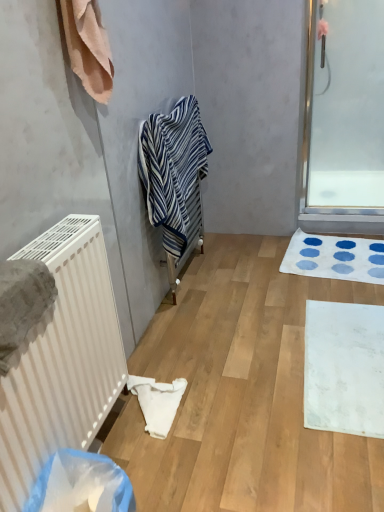
Question: Does white matte bath mat at lower right, the 2th bath mat from the top, have a lesser width compared to beige cotton towel at upper left, the 2th towel in the front-to-back sequence?

Choices:
 (A) yes
 (B) no

Answer: (B)

Question: Is white matte bath mat at lower right, which appears as the first bath mat when viewed from the front, directly adjacent to beige cotton towel at upper left, the 2th towel in the front-to-back sequence?

Choices:
 (A) yes
 (B) no

Answer: (B)

Question: Can you confirm if white matte bath mat at lower right, arranged as the second bath mat when viewed from the back, is shorter than beige cotton towel at upper left, placed as the second towel when sorted from back to front?

Choices:
 (A) no
 (B) yes

Answer: (B)

Question: From the image's perspective, is white matte bath mat at lower right, the first bath mat when ordered from bottom to top, beneath beige cotton towel at upper left, marked as the second towel in a right-to-left arrangement?

Choices:
 (A) no
 (B) yes

Answer: (B)

Question: Considering the relative sizes of white matte bath mat at lower right, which appears as the first bath mat when viewed from the front, and beige cotton towel at upper left, placed as the second towel when sorted from back to front, in the image provided, is white matte bath mat at lower right, which appears as the first bath mat when viewed from the front, bigger than beige cotton towel at upper left, placed as the second towel when sorted from back to front,?

Choices:
 (A) yes
 (B) no

Answer: (A)

Question: From their relative heights in the image, would you say gray textured towel at left, positioned as the 1th towel in front-to-back order, is taller or shorter than white matte bath mat at lower right, arranged as the second bath mat when viewed from the back?

Choices:
 (A) tall
 (B) short

Answer: (A)

Question: From a real-world perspective, is gray textured towel at left, the first towel viewed from the left, positioned above or below white matte bath mat at lower right, the first bath mat when ordered from bottom to top?

Choices:
 (A) below
 (B) above

Answer: (B)

Question: From the image's perspective, relative to white matte bath mat at lower right, the first bath mat when ordered from bottom to top, is gray textured towel at left, the first towel viewed from the left, above or below?

Choices:
 (A) below
 (B) above

Answer: (B)

Question: Does point [x=52, y=298] appear closer or farther from the camera than point [x=331, y=321]?

Choices:
 (A) closer
 (B) farther

Answer: (A)

Question: Relative to white matte bath mat at lower right, the 2th bath mat from the top, is white textured bath mat at lower right, the first bath mat from the back, in front or behind?

Choices:
 (A) front
 (B) behind

Answer: (B)

Question: Looking at the image, does white textured bath mat at lower right, the first bath mat from the back, seem bigger or smaller compared to white matte bath mat at lower right, which appears as the first bath mat when viewed from the front?

Choices:
 (A) small
 (B) big

Answer: (B)

Question: Considering the positions of point (291, 267) and point (311, 377), is point (291, 267) closer or farther from the camera than point (311, 377)?

Choices:
 (A) closer
 (B) farther

Answer: (B)

Question: Do you think white textured bath mat at lower right, the first bath mat from the back, is within white matte bath mat at lower right, which appears as the first bath mat when viewed from the front, or outside of it?

Choices:
 (A) inside
 (B) outside

Answer: (B)

Question: Is blue striped towel at center, the 3th towel positioned from the front, spatially inside white fabric towel at lower center, or outside of it?

Choices:
 (A) outside
 (B) inside

Answer: (A)

Question: Looking at their shapes, would you say blue striped towel at center, acting as the first towel starting from the back, is wider or thinner than white fabric towel at lower center?

Choices:
 (A) thin
 (B) wide

Answer: (A)